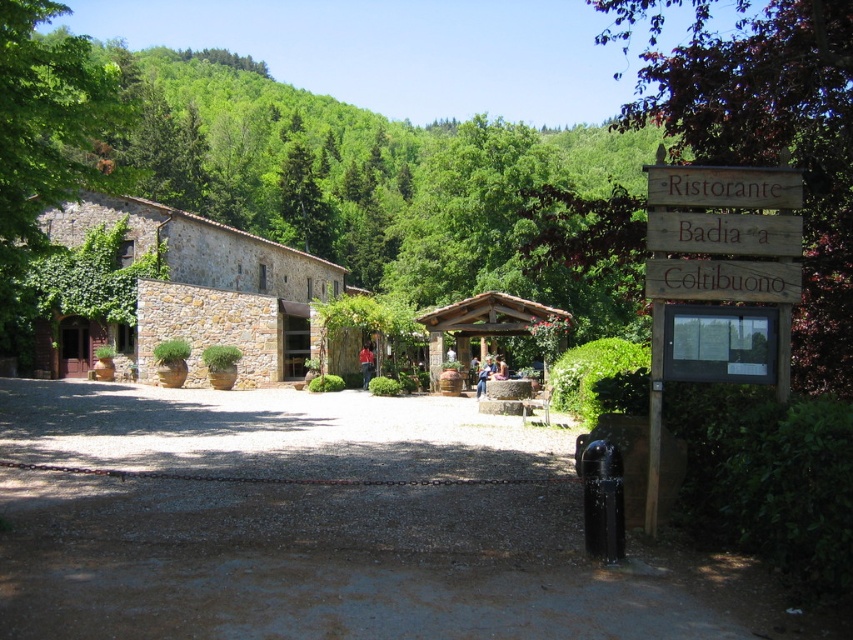
You are driving a car that is 4 meters long. You need to park your car between the gravel driveway at center and the wooden sign at right. Is there enough space to park your car without overlapping either of them?

The distance between the gravel driveway at center and the wooden sign at right is 4.27 meters. Since your car is 4 meters long, there is enough space to park without overlapping either object.

You are standing at the entrance of Ristorante Badia a Coltibuono and see two points marked on the gravel driveway. One is at coordinate point (727, 564) and the other at point (711, 248). Which point is closer to you?

Point (727, 564) is in front of point (711, 248), so it is closer to you.

You are a visitor approaching the entrance of Ristorante Badia a Coltibuono. You notice the gravel driveway at center and the green leafy tree at right. Which object is taller?

The green leafy tree at right is taller than the gravel driveway at center.